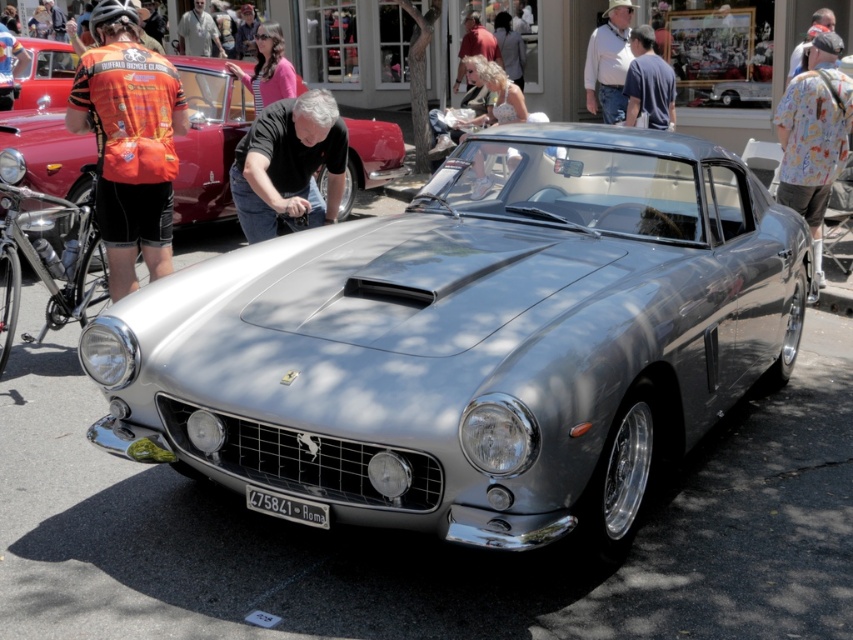
Question: Does matte red car at upper left have a smaller size compared to light blonde hair at upper center?

Choices:
 (A) no
 (B) yes

Answer: (A)

Question: Which is farther from the floral shirt at right?

Choices:
 (A) light blonde hair at upper center
 (B) black metal/texture license plate at center
 (C) matte red car at upper left
 (D) black smooth shirt at center

Answer: (C)

Question: Can you confirm if black smooth shirt at center is positioned above white cotton shirt at upper center?

Choices:
 (A) no
 (B) yes

Answer: (A)

Question: Which point is farther to the camera?

Choices:
 (A) (787, 108)
 (B) (308, 195)

Answer: (A)

Question: Which object appears closest to the camera in this image?

Choices:
 (A) light blonde hair at upper center
 (B) black smooth shirt at center
 (C) shiny silver car at center
 (D) orange cycling jersey at upper left

Answer: (B)

Question: Is black metal/texture license plate at center below blonde hair at center?

Choices:
 (A) yes
 (B) no

Answer: (A)